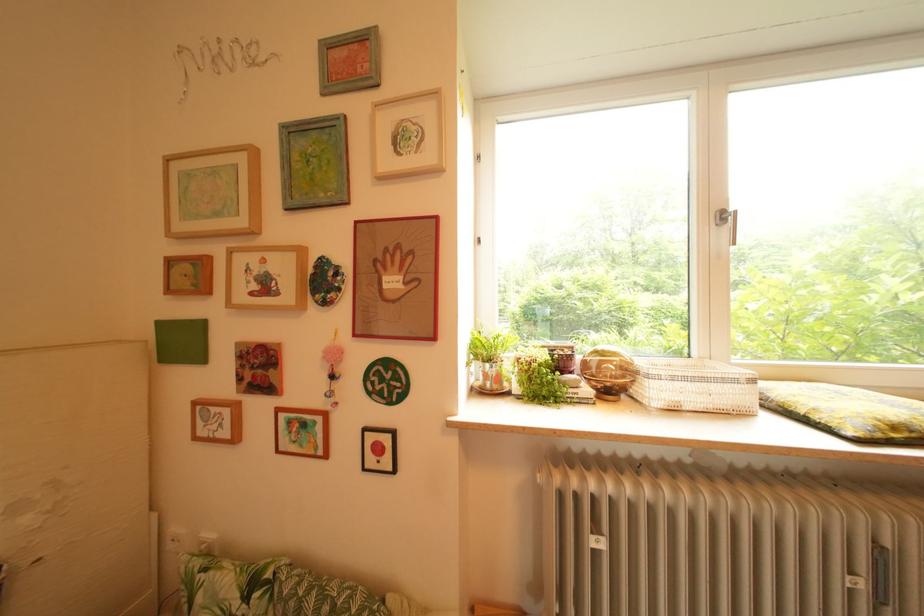
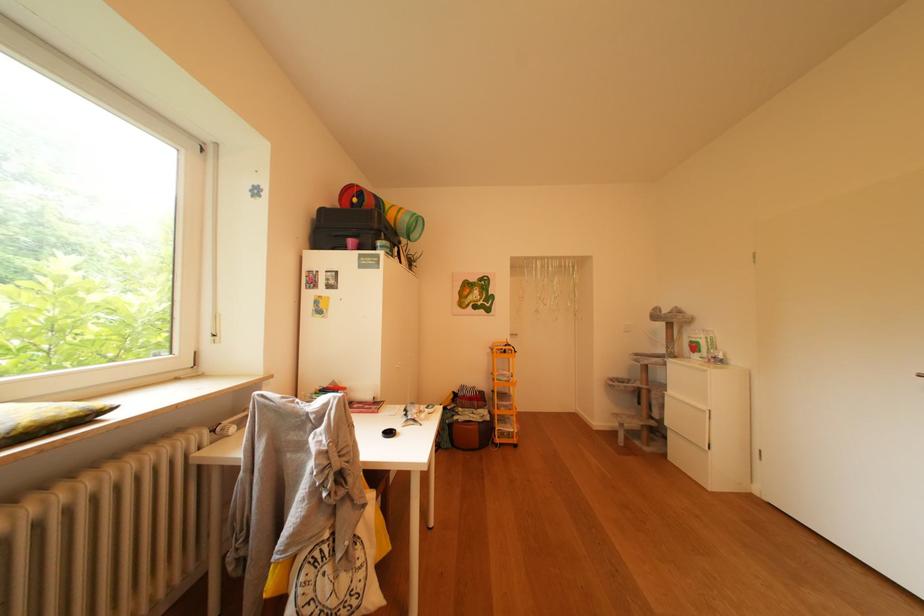
Question: The images are taken continuously from a first-person perspective. In which direction is your viewpoint rotating?

Choices:
 (A) Left
 (B) Right
 (C) Up
 (D) Down

Answer: (B)